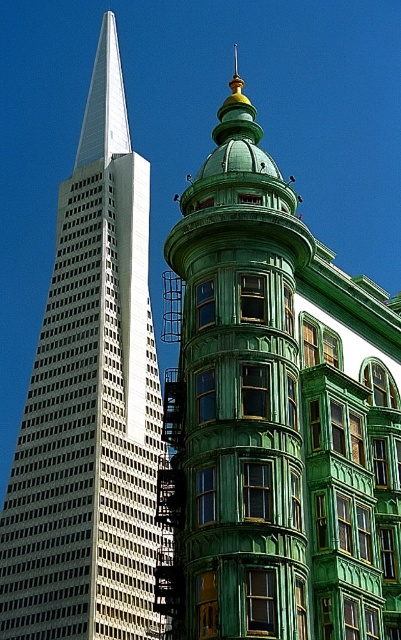
Question: Does green glossy building at center appear on the right side of white glass skyscraper at left?

Choices:
 (A) no
 (B) yes

Answer: (B)

Question: Which of the following is the farthest from the observer?

Choices:
 (A) (384, 442)
 (B) (135, 627)

Answer: (B)

Question: Can you confirm if green glossy building at center is positioned below white glass skyscraper at left?

Choices:
 (A) yes
 (B) no

Answer: (A)

Question: Is green glossy building at center to the right of white glass skyscraper at left from the viewer's perspective?

Choices:
 (A) no
 (B) yes

Answer: (B)